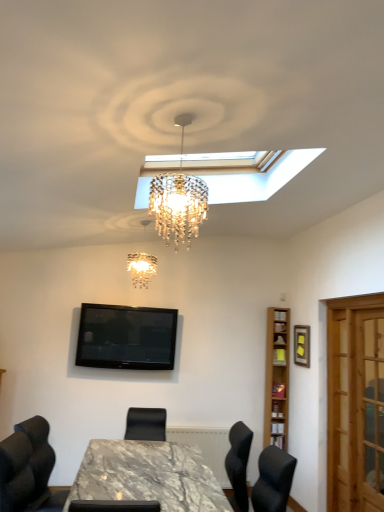
Question: From the image's perspective, is wooden picture frame at upper right positioned above or below crystal chandelier at center?

Choices:
 (A) above
 (B) below

Answer: (B)

Question: Based on their positions, is wooden picture frame at upper right located to the left or right of crystal chandelier at center?

Choices:
 (A) left
 (B) right

Answer: (B)

Question: Which object is positioned farthest from the marble table at center?

Choices:
 (A) light brown wooden bookshelf at right
 (B) wooden screen door at right
 (C) wooden picture frame at upper right
 (D) black glossy tv at upper center
 (E) crystal chandelier at center

Answer: (C)

Question: Which of these objects is positioned closest to the crystal chandelier at center?

Choices:
 (A) marble table at center
 (B) black glossy tv at upper center
 (C) light brown wooden bookshelf at right
 (D) wooden screen door at right
 (E) wooden picture frame at upper right

Answer: (B)